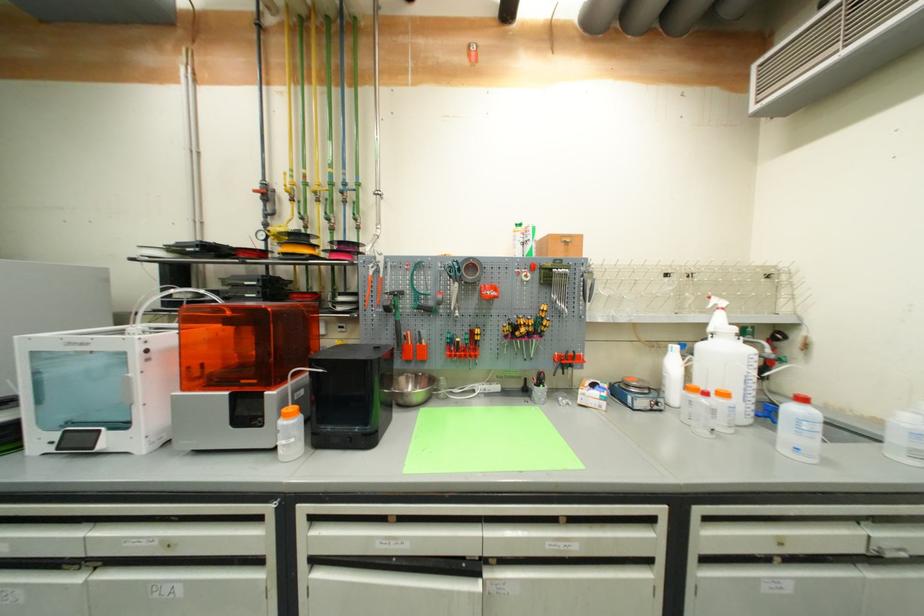
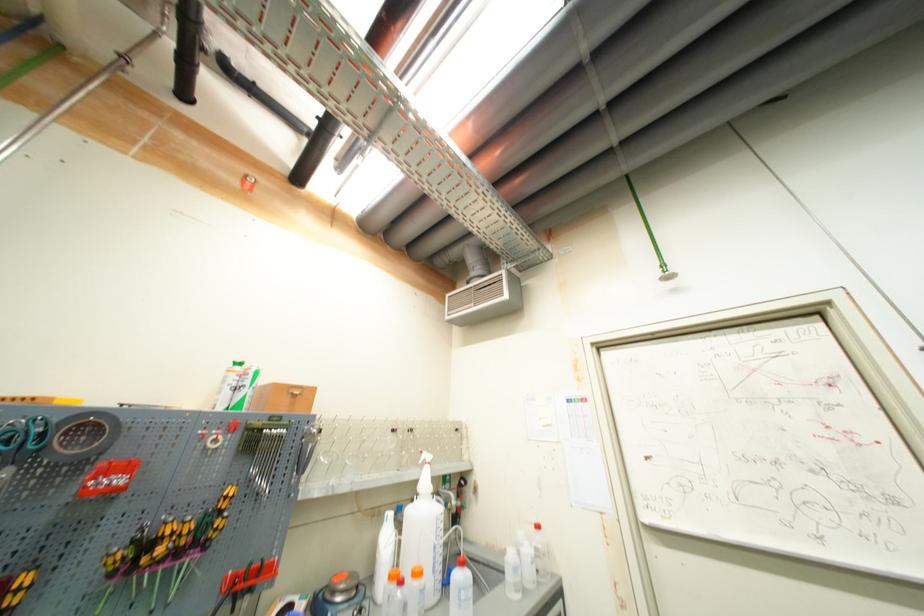
The point at (685, 408) is marked in the first image. Where is the corresponding point in the second image?

(386, 610)